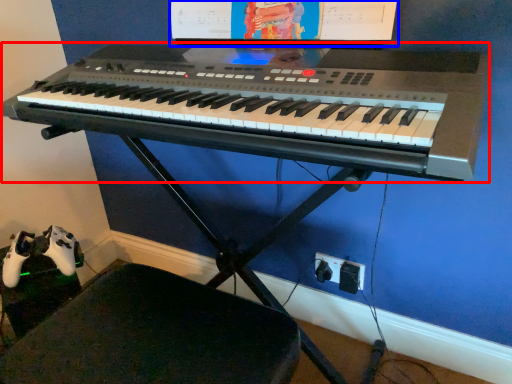
Question: Which point is further to the camera, musical keyboard (highlighted by a red box) or computer monitor (highlighted by a blue box)?

Choices:
 (A) musical keyboard
 (B) computer monitor

Answer: (B)